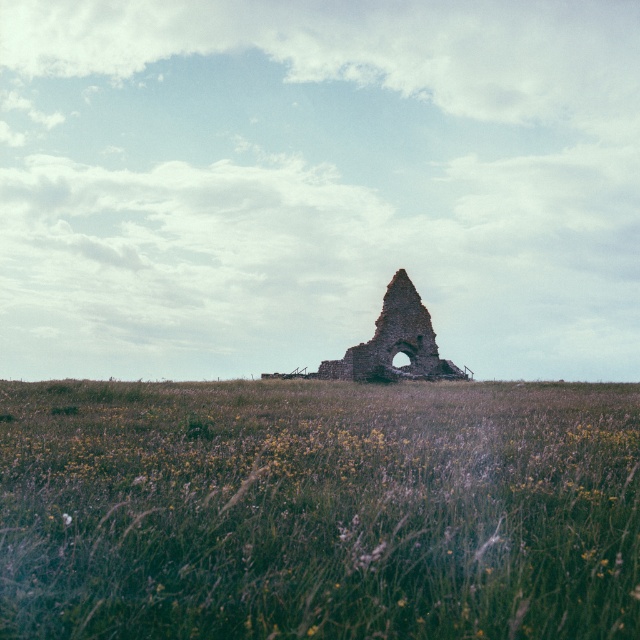
Question: Which object is closer to the camera taking this photo?

Choices:
 (A) green grassy field at center
 (B) brown stone ruins at center

Answer: (A)

Question: Can you confirm if green grassy field at center is bigger than brown stone ruins at center?

Choices:
 (A) no
 (B) yes

Answer: (A)

Question: Where is green grassy field at center located in relation to brown stone ruins at center in the image?

Choices:
 (A) left
 (B) right

Answer: (A)

Question: From the image, what is the correct spatial relationship of green grassy field at center in relation to brown stone ruins at center?

Choices:
 (A) below
 (B) above

Answer: (A)

Question: Which point appears closest to the camera in this image?

Choices:
 (A) (104, 566)
 (B) (396, 316)

Answer: (A)